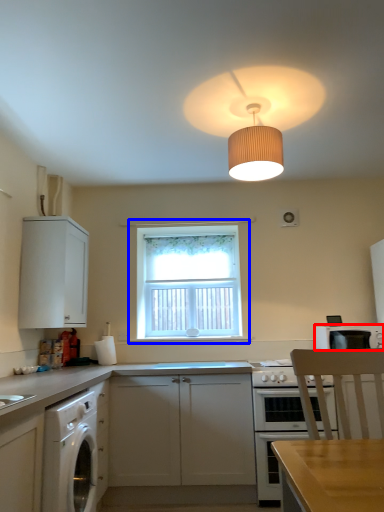
Question: Which object appears farthest to the camera in this image, kitchen appliance (highlighted by a red box) or window (highlighted by a blue box)?

Choices:
 (A) kitchen appliance
 (B) window

Answer: (B)